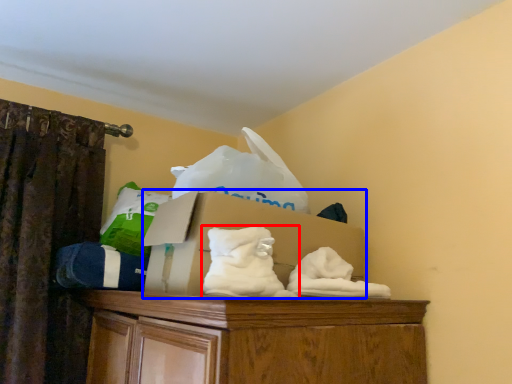
Question: Which object appears farthest to the camera in this image, sheet (highlighted by a red box) or cardboard box (highlighted by a blue box)?

Choices:
 (A) sheet
 (B) cardboard box

Answer: (B)